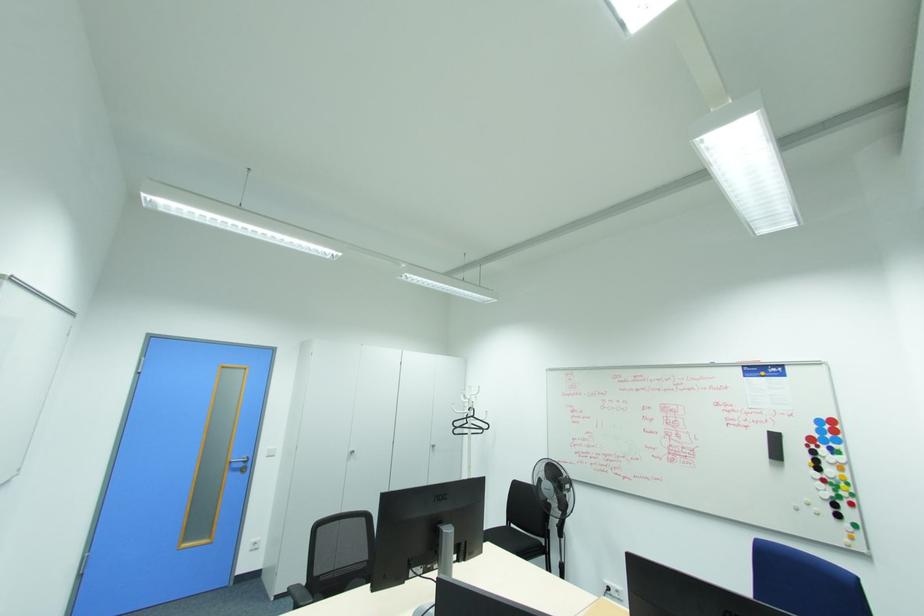
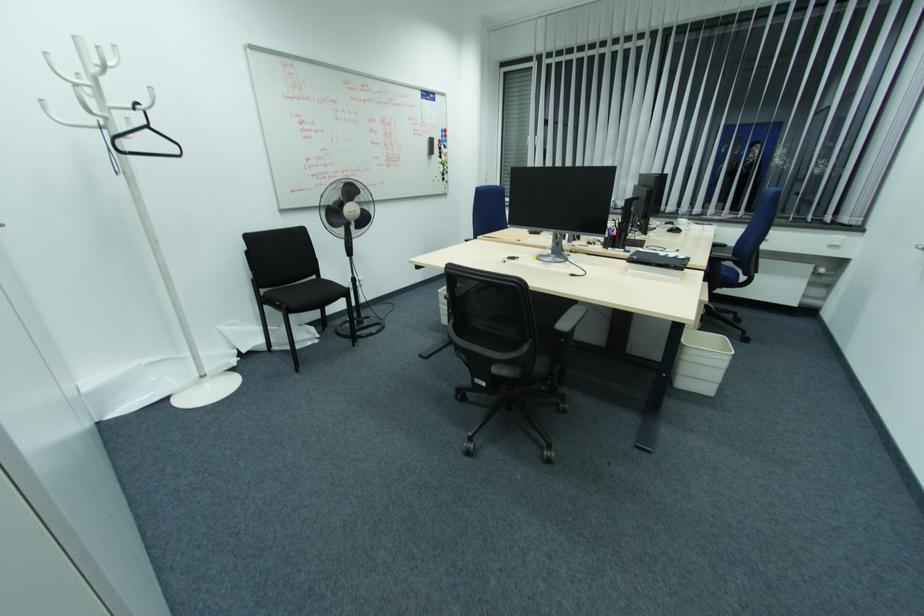
In the second image, find the point that corresponds to (x=820, y=422) in the first image.

(444, 131)